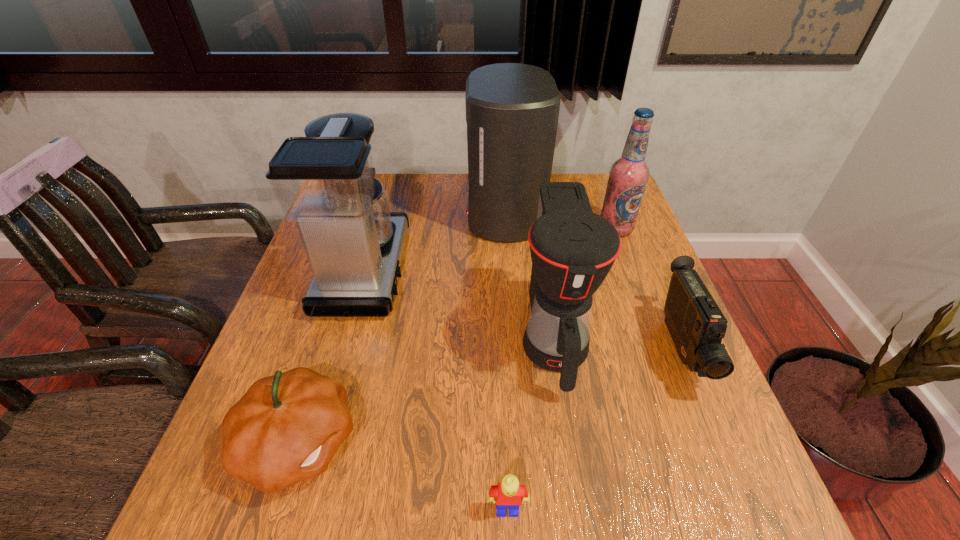
Find the location of a particular element. The width and height of the screenshot is (960, 540). vacant space situated 0.350m on the front face of the pumpkin is located at coordinates (552, 442).

Locate an element on the screen. Image resolution: width=960 pixels, height=540 pixels. object positioned at the far edge is located at coordinates (512, 109).

Locate an element on the screen. This screenshot has width=960, height=540. pumpkin at the near edge is located at coordinates (286, 428).

Find the location of a particular element. Lego at the near edge is located at coordinates (509, 493).

At what (x,y) coordinates should I click in order to perform the action: click on coffee maker that is at the left edge. Please return your answer as a coordinate pair (x, y). Looking at the image, I should click on (324, 182).

What are the coordinates of `pumpkin situated at the left edge` in the screenshot? It's located at (286, 428).

You are a GUI agent. You are given a task and a screenshot of the screen. Output one action in this format:
    pyautogui.click(x=<x>, y=<y>)
    Task: Click on the alcohol present at the right edge
    Image resolution: width=960 pixels, height=540 pixels.
    Given the screenshot: What is the action you would take?
    pyautogui.click(x=628, y=176)

The width and height of the screenshot is (960, 540). In order to click on camcorder that is at the right edge in this screenshot , I will do `click(697, 325)`.

Where is `object present at the near left corner`? The width and height of the screenshot is (960, 540). object present at the near left corner is located at coordinates (286, 428).

In the image, there is a desktop. What are the coordinates of `blank space at the far edge` in the screenshot? It's located at (413, 207).